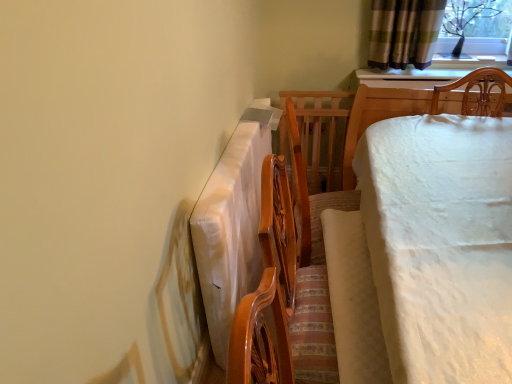
Consider the image. Measure the distance between point [331,265] and camera.

Point [331,265] is 4.59 feet from camera.

Identify the location of white plastic tablecloth at center. The width and height of the screenshot is (512, 384). (232, 223).

From the image's perspective, which is below, white fabric-covered bed at right or white plastic tablecloth at center?

white fabric-covered bed at right.

Considering the positions of points (373, 136) and (231, 276), is point (373, 136) farther from camera compared to point (231, 276)?

Yes, point (373, 136) is behind point (231, 276).

From a real-world perspective, is white fabric-covered bed at right over white plastic tablecloth at center?

Yes, from a real-world perspective, white fabric-covered bed at right is above white plastic tablecloth at center.

Who is smaller, white fabric-covered bed at right or white plastic tablecloth at center?

With smaller size is white plastic tablecloth at center.

Is white fabric-covered bed at right bigger than clear glass window screen at upper right?

Correct, white fabric-covered bed at right is larger in size than clear glass window screen at upper right.

Is point (509, 184) closer or farther from the camera than point (498, 40)?

Point (509, 184) is positioned closer to the camera compared to point (498, 40).

Could you tell me if white fabric-covered bed at right is facing clear glass window screen at upper right?

Yes, white fabric-covered bed at right is turned towards clear glass window screen at upper right.

From a real-world perspective, between white fabric-covered bed at right and clear glass window screen at upper right, who is vertically higher?

clear glass window screen at upper right is physically above.

Considering the relative sizes of clear glass window screen at upper right and light beige fabric at center in the image provided, is clear glass window screen at upper right bigger than light beige fabric at center?

Yes, clear glass window screen at upper right is bigger than light beige fabric at center.

Who is shorter, clear glass window screen at upper right or light beige fabric at center?

With less height is light beige fabric at center.

What's the angular difference between clear glass window screen at upper right and light beige fabric at center's facing directions?

They differ by 92.5 degrees in their facing directions.

Can light beige fabric at center be found inside clear glass window screen at upper right?

No, clear glass window screen at upper right does not contain light beige fabric at center.

Which of these two, clear glass window screen at upper right or white plastic tablecloth at center, is thinner?

white plastic tablecloth at center is thinner.

Is clear glass window screen at upper right smaller than white plastic tablecloth at center?

Indeed, clear glass window screen at upper right has a smaller size compared to white plastic tablecloth at center.

In the scene shown: Is clear glass window screen at upper right taller than white plastic tablecloth at center?

No, clear glass window screen at upper right is not taller than white plastic tablecloth at center.

Is clear glass window screen at upper right turned away from white plastic tablecloth at center?

clear glass window screen at upper right is not turned away from white plastic tablecloth at center.

Considering the relative sizes of white plastic tablecloth at center and white fabric-covered bed at right in the image provided, is white plastic tablecloth at center smaller than white fabric-covered bed at right?

Yes, white plastic tablecloth at center is smaller than white fabric-covered bed at right.

Is point (243, 154) closer or farther from the camera than point (492, 305)?

Point (243, 154) is positioned farther from the camera compared to point (492, 305).

From a real-world perspective, is white plastic tablecloth at center below white fabric-covered bed at right?

Yes, from a real-world perspective, white plastic tablecloth at center is beneath white fabric-covered bed at right.

Is light beige fabric at center outside of clear glass window screen at upper right?

light beige fabric at center lies outside clear glass window screen at upper right's area.

Where is `blanket below the clear glass window screen at upper right (from a real-world perspective)`? Image resolution: width=512 pixels, height=384 pixels. blanket below the clear glass window screen at upper right (from a real-world perspective) is located at coordinates (353, 300).

What's the angular difference between light beige fabric at center and clear glass window screen at upper right's facing directions?

light beige fabric at center and clear glass window screen at upper right are facing 92.5 degrees away from each other.

Does light beige fabric at center turn towards clear glass window screen at upper right?

No, light beige fabric at center is not aimed at clear glass window screen at upper right.

Based on their sizes in the image, would you say white plastic tablecloth at center is bigger or smaller than light beige fabric at center?

In the image, white plastic tablecloth at center appears to be larger than light beige fabric at center.

How far apart are white plastic tablecloth at center and light beige fabric at center?

The distance of white plastic tablecloth at center from light beige fabric at center is 17.66 inches.

From the image's perspective, does white plastic tablecloth at center appear higher than light beige fabric at center?

Yes, from the image's perspective, white plastic tablecloth at center is above light beige fabric at center.

From a real-world perspective, is white plastic tablecloth at center physically below light beige fabric at center?

Indeed, from a real-world perspective, white plastic tablecloth at center is positioned beneath light beige fabric at center.

At what (x,y) coordinates should I click in order to perform the action: click on tablecloth below the white fabric-covered bed at right (from a real-world perspective). Please return your answer as a coordinate pair (x, y). The image size is (512, 384). Looking at the image, I should click on (232, 223).

I want to click on window screen above the white fabric-covered bed at right (from the image's perspective), so click(x=475, y=27).

From the image, which object appears to be farther from white fabric-covered bed at right, white plastic tablecloth at center or clear glass window screen at upper right?

clear glass window screen at upper right.

From the image, which object appears to be nearer to clear glass window screen at upper right, light beige fabric at center or white plastic tablecloth at center?

white plastic tablecloth at center lies closer to clear glass window screen at upper right than the other object.

Based on their spatial positions, is light beige fabric at center or white fabric-covered bed at right closer to white plastic tablecloth at center?

Among the two, light beige fabric at center is located nearer to white plastic tablecloth at center.

Based on their spatial positions, is clear glass window screen at upper right or light beige fabric at center further from white plastic tablecloth at center?

clear glass window screen at upper right is positioned further to the anchor white plastic tablecloth at center.

Estimate the real-world distances between objects in this image. Which object is further from clear glass window screen at upper right, white plastic tablecloth at center or light beige fabric at center?

light beige fabric at center.

Considering their positions, is white fabric-covered bed at right positioned closer to light beige fabric at center than clear glass window screen at upper right?

white fabric-covered bed at right.

Looking at the image, which one is located closer to white fabric-covered bed at right, light beige fabric at center or white plastic tablecloth at center?

Among the two, light beige fabric at center is located nearer to white fabric-covered bed at right.

When comparing their distances from white plastic tablecloth at center, does white fabric-covered bed at right or clear glass window screen at upper right seem closer?

white fabric-covered bed at right.

You are a GUI agent. You are given a task and a screenshot of the screen. Output one action in this format:
    pyautogui.click(x=<x>, y=<y>)
    Task: Click on the tablecloth between light beige fabric at center and clear glass window screen at upper right from front to back
    
    Given the screenshot: What is the action you would take?
    [232, 223]

Where is `blanket situated between white plastic tablecloth at center and white fabric-covered bed at right from left to right`? This screenshot has width=512, height=384. blanket situated between white plastic tablecloth at center and white fabric-covered bed at right from left to right is located at coordinates (353, 300).

This screenshot has width=512, height=384. Find the location of `tablecloth positioned between white fabric-covered bed at right and clear glass window screen at upper right from near to far`. tablecloth positioned between white fabric-covered bed at right and clear glass window screen at upper right from near to far is located at coordinates (232, 223).

You are a GUI agent. You are given a task and a screenshot of the screen. Output one action in this format:
    pyautogui.click(x=<x>, y=<y>)
    Task: Click on the blanket between white fabric-covered bed at right and clear glass window screen at upper right in the front-back direction
    The width and height of the screenshot is (512, 384).
    Given the screenshot: What is the action you would take?
    pyautogui.click(x=353, y=300)